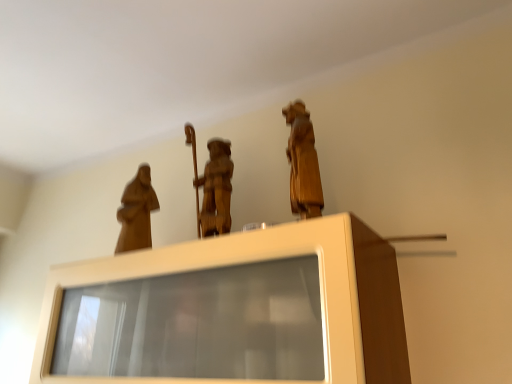
What do you see at coordinates (136, 212) in the screenshot? The image size is (512, 384). I see `matte wood statue at left, the second person in the right-to-left sequence` at bounding box center [136, 212].

Where is `matte wood statue at left, marked as the second person in a front-to-back arrangement`? The width and height of the screenshot is (512, 384). matte wood statue at left, marked as the second person in a front-to-back arrangement is located at coordinates (136, 212).

Locate an element on the screen. person that is above the wooden statue at upper center, which is the 2th person in back-to-front order (from a real-world perspective) is located at coordinates (136, 212).

Who is taller, matte wood statue at left, marked as the second person in a front-to-back arrangement, or wooden statue at upper center, the first person viewed from the right?

Standing taller between the two is wooden statue at upper center, the first person viewed from the right.

From the picture: Considering the relative sizes of matte wood statue at left, the first person positioned from the left, and wooden statue at upper center, positioned as the first person in front-to-back order, in the image provided, is matte wood statue at left, the first person positioned from the left, thinner than wooden statue at upper center, positioned as the first person in front-to-back order,?

Yes, matte wood statue at left, the first person positioned from the left, is thinner than wooden statue at upper center, positioned as the first person in front-to-back order.

Is matte wood statue at left, the first person positioned from the left, at the back of wooden statue at upper center, the 2th person viewed from the left?

No, wooden statue at upper center, the 2th person viewed from the left, is not facing away from matte wood statue at left, the first person positioned from the left.

Considering the sizes of objects wooden statue at upper center, the 2th person viewed from the left, and matte wood statue at left, the first person positioned from the left, in the image provided, who is thinner, wooden statue at upper center, the 2th person viewed from the left, or matte wood statue at left, the first person positioned from the left,?

matte wood statue at left, the first person positioned from the left, is thinner.

Consider the image. Is wooden statue at upper center, positioned as the first person in front-to-back order, bigger than matte wood statue at left, the second person in the right-to-left sequence?

Yes, wooden statue at upper center, positioned as the first person in front-to-back order, is bigger than matte wood statue at left, the second person in the right-to-left sequence.

Considering their positions, is wooden statue at upper center, which is the 2th person in back-to-front order, located in front of or behind matte wood statue at left, the first person positioned from the left?

Clearly, wooden statue at upper center, which is the 2th person in back-to-front order, is in front of matte wood statue at left, the first person positioned from the left.

Would you say matte wood cabinet at center is a long distance from matte wood statue at left, the second person in the right-to-left sequence?

No, there isn't a large distance between matte wood cabinet at center and matte wood statue at left, the second person in the right-to-left sequence.

Is matte wood cabinet at center shorter than matte wood statue at left, the 1th person from the back?

No, matte wood cabinet at center is not shorter than matte wood statue at left, the 1th person from the back.

Can you confirm if matte wood cabinet at center is wider than matte wood statue at left, the 1th person from the back?

Correct, the width of matte wood cabinet at center exceeds that of matte wood statue at left, the 1th person from the back.

Does matte wood cabinet at center lie behind matte wood statue at left, marked as the second person in a front-to-back arrangement?

No, matte wood cabinet at center is closer to the camera.

Is wooden statue at upper center, the first person viewed from the right, not near matte wood cabinet at center?

No.

Looking at this image, considering the relative sizes of wooden statue at upper center, the first person viewed from the right, and matte wood cabinet at center in the image provided, is wooden statue at upper center, the first person viewed from the right, bigger than matte wood cabinet at center?

No, wooden statue at upper center, the first person viewed from the right, is not bigger than matte wood cabinet at center.

Image resolution: width=512 pixels, height=384 pixels. I want to click on person on the right of matte wood cabinet at center, so click(x=303, y=163).

From the picture: Is matte wood cabinet at center surrounded by wooden statue at upper center, the 2th person viewed from the left?

Definitely not — matte wood cabinet at center is not inside wooden statue at upper center, the 2th person viewed from the left.

Is matte wood cabinet at center further to camera compared to wooden statue at upper center, which is the 2th person in back-to-front order?

No.

Does matte wood cabinet at center have a lesser height compared to wooden statue at upper center, which is the 2th person in back-to-front order?

Yes.

From the image's perspective, would you say matte wood cabinet at center is shown under wooden statue at upper center, which is the 2th person in back-to-front order?

Yes.

What's the angular difference between matte wood cabinet at center and wooden statue at upper center, which is the 2th person in back-to-front order,'s facing directions?

There is a 62.5-degree angle between the facing directions of matte wood cabinet at center and wooden statue at upper center, which is the 2th person in back-to-front order.

Is there a large distance between matte wood statue at left, the first person positioned from the left, and matte wood cabinet at center?

That's not correct — matte wood statue at left, the first person positioned from the left, is a little close to matte wood cabinet at center.

Does point (118, 249) lie in front of point (42, 333)?

No, it is behind (42, 333).

Is matte wood statue at left, the first person positioned from the left, turned away from matte wood cabinet at center?

That's not correct — matte wood statue at left, the first person positioned from the left, is not looking away from matte wood cabinet at center.

Considering the sizes of objects matte wood statue at left, the second person in the right-to-left sequence, and matte wood cabinet at center in the image provided, who is bigger, matte wood statue at left, the second person in the right-to-left sequence, or matte wood cabinet at center?

matte wood cabinet at center.

The height and width of the screenshot is (384, 512). In the image, there is a matte wood statue at left, the second person in the right-to-left sequence. Find the location of `person above it (from the image's perspective)`. person above it (from the image's perspective) is located at coordinates (303, 163).

In order to click on person behind the wooden statue at upper center, the first person viewed from the right in this screenshot , I will do `click(136, 212)`.

Based on their spatial positions, is matte wood cabinet at center or matte wood statue at left, the second person in the right-to-left sequence, further from wooden statue at upper center, the first person viewed from the right?

matte wood statue at left, the second person in the right-to-left sequence, lies further to wooden statue at upper center, the first person viewed from the right, than the other object.

Which object lies nearer to the anchor point matte wood statue at left, the 1th person from the back, matte wood cabinet at center or wooden statue at upper center, the 2th person viewed from the left?

matte wood cabinet at center is positioned closer to the anchor matte wood statue at left, the 1th person from the back.

Looking at the image, which one is located closer to matte wood cabinet at center, matte wood statue at left, the first person positioned from the left, or wooden statue at upper center, which is the 2th person in back-to-front order?

wooden statue at upper center, which is the 2th person in back-to-front order, lies closer to matte wood cabinet at center than the other object.

Estimate the real-world distances between objects in this image. Which object is further from matte wood cabinet at center, wooden statue at upper center, the first person viewed from the right, or matte wood statue at left, marked as the second person in a front-to-back arrangement?

matte wood statue at left, marked as the second person in a front-to-back arrangement, lies further to matte wood cabinet at center than the other object.

Which object lies further to the anchor point wooden statue at upper center, positioned as the first person in front-to-back order, matte wood statue at left, the second person in the right-to-left sequence, or matte wood cabinet at center?

Among the two, matte wood statue at left, the second person in the right-to-left sequence, is located further to wooden statue at upper center, positioned as the first person in front-to-back order.

Looking at the image, which one is located further to matte wood statue at left, the second person in the right-to-left sequence, wooden statue at upper center, positioned as the first person in front-to-back order, or matte wood cabinet at center?

The object further to matte wood statue at left, the second person in the right-to-left sequence, is wooden statue at upper center, positioned as the first person in front-to-back order.

Locate an element on the screen. person located between matte wood cabinet at center and matte wood statue at left, marked as the second person in a front-to-back arrangement, in the depth direction is located at coordinates (303, 163).